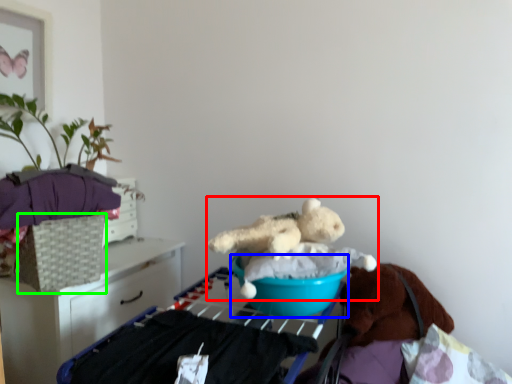
Question: Considering the real-world distances, which object is farthest from teddy bear (highlighted by a red box)? basin (highlighted by a blue box) or basket (highlighted by a green box)?

Choices:
 (A) basin
 (B) basket

Answer: (B)